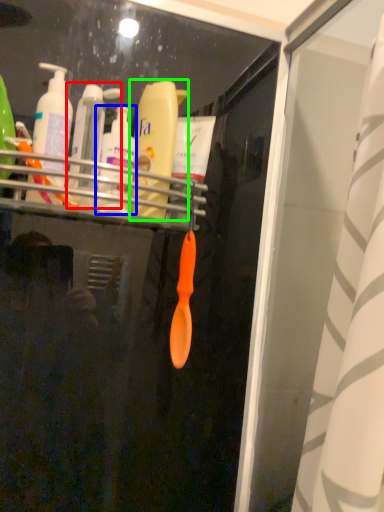
Question: Based on their relative distances, which object is nearer to toiletry (highlighted by a red box)? Choose from toiletry (highlighted by a blue box) and bottle (highlighted by a green box).

Choices:
 (A) toiletry
 (B) bottle

Answer: (A)